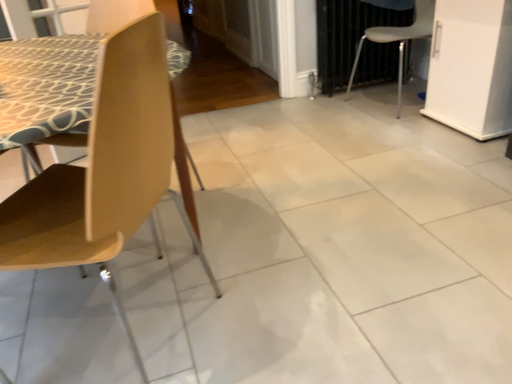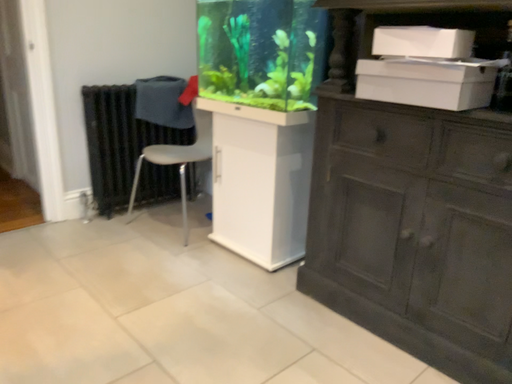
Question: How did the camera likely rotate when shooting the video?

Choices:
 (A) rotated upward
 (B) rotated downward

Answer: (A)